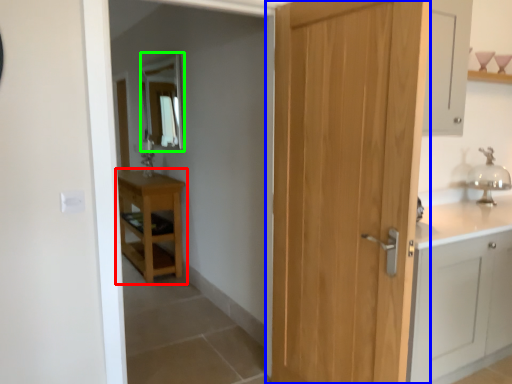
Question: Which object is the closest to the table (highlighted by a red box)? Choose among these: door (highlighted by a blue box) or mirror (highlighted by a green box).

Choices:
 (A) door
 (B) mirror

Answer: (B)